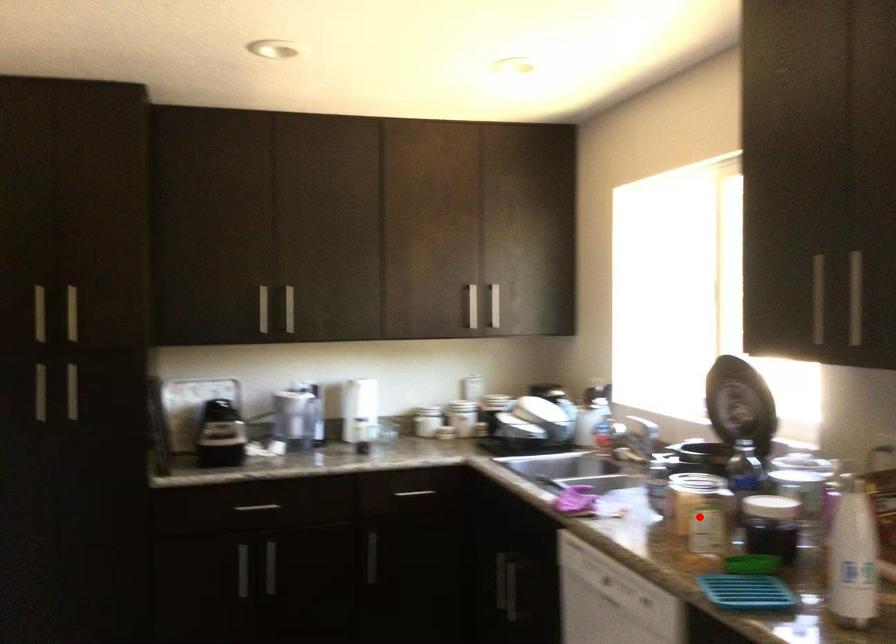
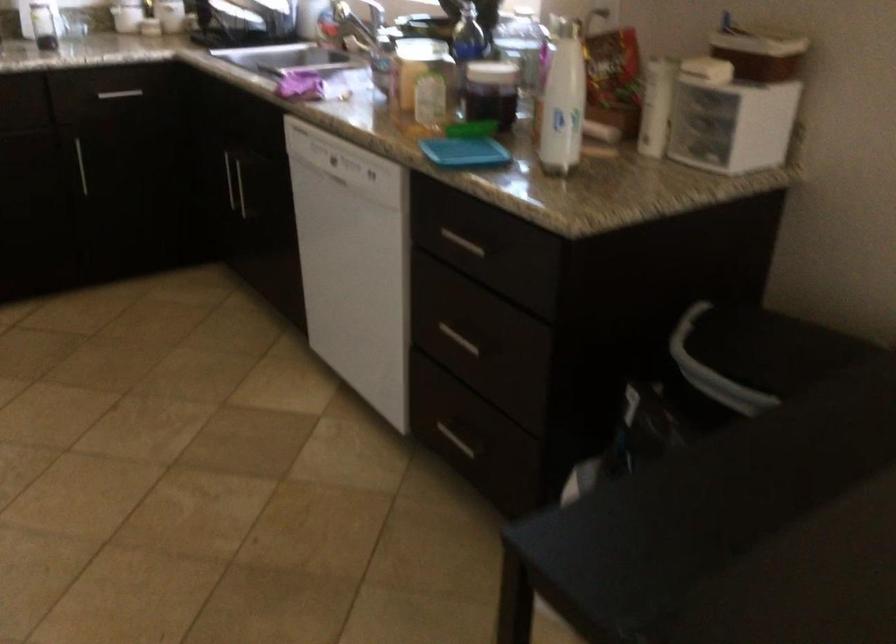
Find the pixel in the second image that matches the highlighted location in the first image.

(421, 84)